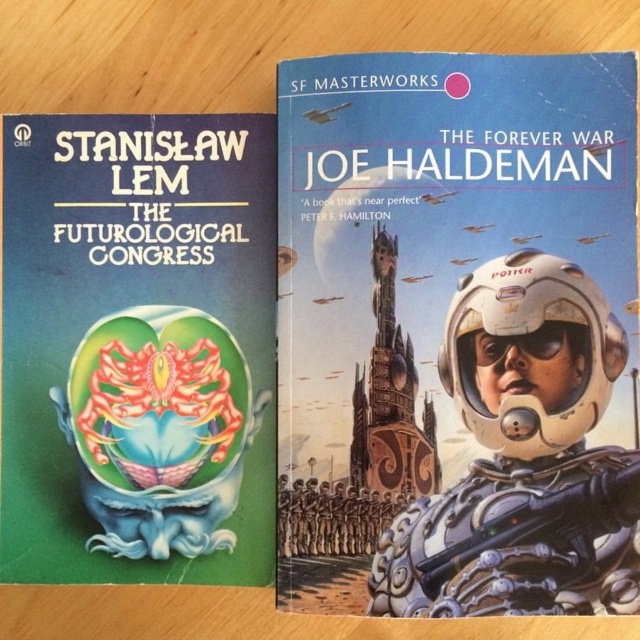
Is green matte brain at center positioned before white metallic astronaut at center?

No, green matte brain at center is behind white metallic astronaut at center.

Is point (188, 417) in front of point (492, 438)?

No, it is behind (492, 438).

Where is `green matte brain at center`? The image size is (640, 640). green matte brain at center is located at coordinates (138, 348).

Where is `metallic silver spacesuit at center`? This screenshot has height=640, width=640. metallic silver spacesuit at center is located at coordinates (458, 333).

Can you confirm if metallic silver spacesuit at center is smaller than white metallic astronaut at center?

No.

Measure the distance between metallic silver spacesuit at center and camera.

A distance of 24.17 inches exists between metallic silver spacesuit at center and camera.

I want to click on metallic silver spacesuit at center, so click(x=458, y=333).

Does metallic silver spacesuit at center appear over green matte brain at center?

Yes.

Between metallic silver spacesuit at center and green matte brain at center, which one has less height?

Standing shorter between the two is green matte brain at center.

Where is `metallic silver spacesuit at center`? The image size is (640, 640). metallic silver spacesuit at center is located at coordinates click(458, 333).

Image resolution: width=640 pixels, height=640 pixels. Identify the location of metallic silver spacesuit at center. (458, 333).